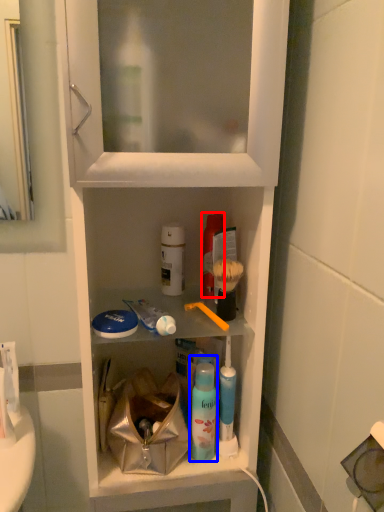
Question: Which object appears farthest to the camera in this image, mouthwash (highlighted by a red box) or mouthwash (highlighted by a blue box)?

Choices:
 (A) mouthwash
 (B) mouthwash

Answer: (A)